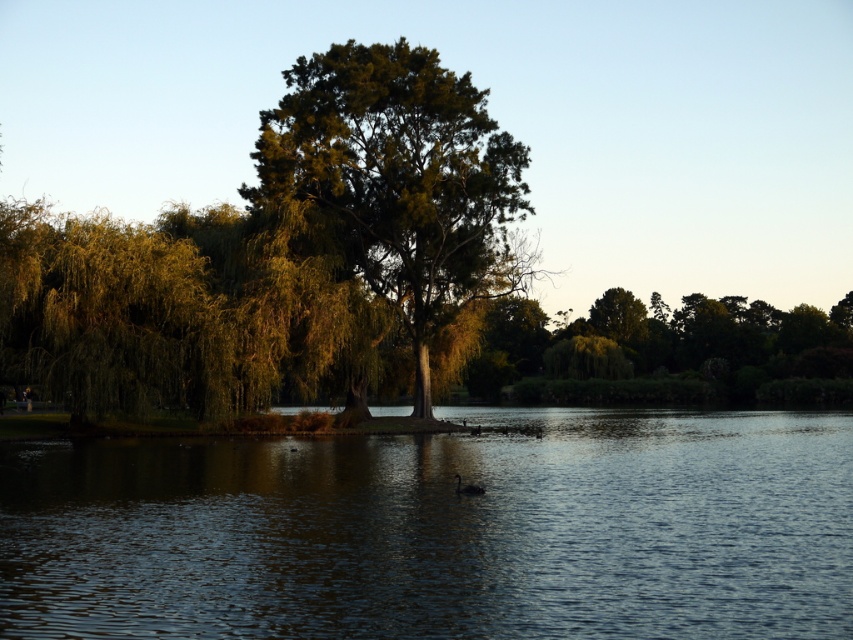
Does dark reflective water at center have a lesser height compared to green leafy tree at center?

Yes.

Is dark reflective water at center to the left of green leafy tree at center from the viewer's perspective?

Correct, you'll find dark reflective water at center to the left of green leafy tree at center.

Locate an element on the screen. This screenshot has width=853, height=640. dark reflective water at center is located at coordinates pos(440,531).

Locate an element on the screen. The image size is (853, 640). dark reflective water at center is located at coordinates (x=440, y=531).

In the scene shown: Between green leafy tree at center and black matte duck at center, which one appears on the left side from the viewer's perspective?

green leafy tree at center

Is green leafy tree at center to the right of black matte duck at center from the viewer's perspective?

Incorrect, green leafy tree at center is not on the right side of black matte duck at center.

Locate an element on the screen. The height and width of the screenshot is (640, 853). green leafy tree at center is located at coordinates (401, 180).

Which is above, dark reflective water at center or black matte duck at center?

→ Positioned higher is black matte duck at center.

The width and height of the screenshot is (853, 640). I want to click on dark reflective water at center, so click(x=440, y=531).

I want to click on dark reflective water at center, so click(440, 531).